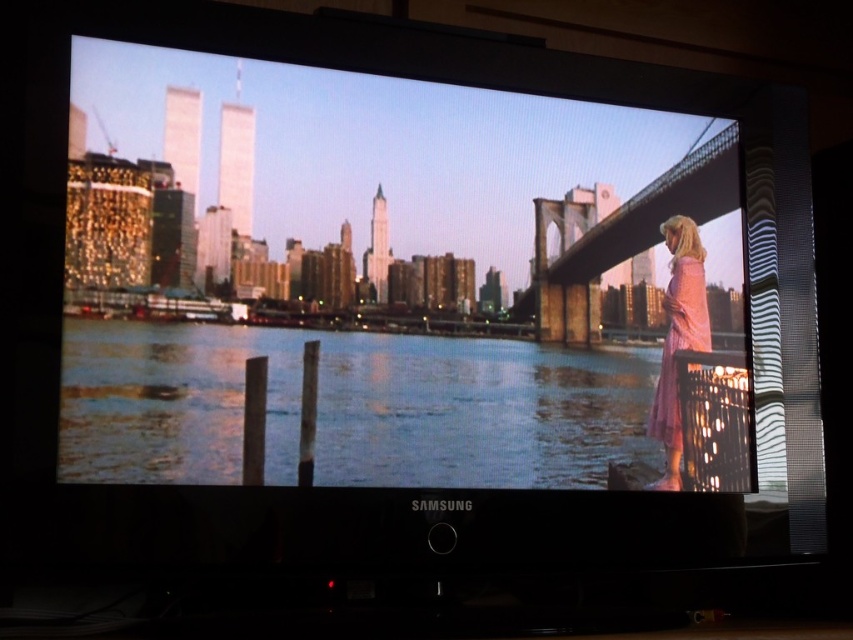
Between blue reflective water at lower center and pink satin dress at right, which one is positioned higher?

Positioned higher is pink satin dress at right.

Consider the image. Does blue reflective water at lower center have a smaller size compared to pink satin dress at right?

No, blue reflective water at lower center is not smaller than pink satin dress at right.

Who is more forward, (x=698, y=365) or (x=682, y=305)?

Positioned in front is point (x=698, y=365).

This screenshot has height=640, width=853. Identify the location of blue reflective water at lower center. (352, 408).

Which of these two, pink fabric woman at right or pink satin dress at right, stands shorter?

pink satin dress at right

Does pink fabric woman at right appear over pink satin dress at right?

Yes, pink fabric woman at right is above pink satin dress at right.

Is point (553, 205) closer to camera compared to point (669, 410)?

Yes.

You are a GUI agent. You are given a task and a screenshot of the screen. Output one action in this format:
    pyautogui.click(x=<x>, y=<y>)
    Task: Click on the pink fabric woman at right
    Image resolution: width=853 pixels, height=640 pixels.
    Given the screenshot: What is the action you would take?
    pyautogui.click(x=380, y=275)

Measure the distance between pink fabric woman at right and blue reflective water at lower center.

5.71 centimeters

Which is behind, point (339, 385) or point (277, 369)?

The point (339, 385) is behind.

Which is in front, point (485, 163) or point (71, 323)?

Point (71, 323) is more forward.

The height and width of the screenshot is (640, 853). What are the coordinates of `pink fabric woman at right` in the screenshot? It's located at (380, 275).